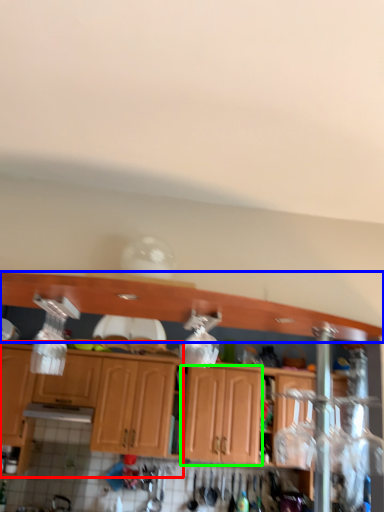
Question: Which is farther away from cabinetry (highlighted by a red box)? cabinetry (highlighted by a blue box) or cabinetry (highlighted by a green box)?

Choices:
 (A) cabinetry
 (B) cabinetry

Answer: (A)